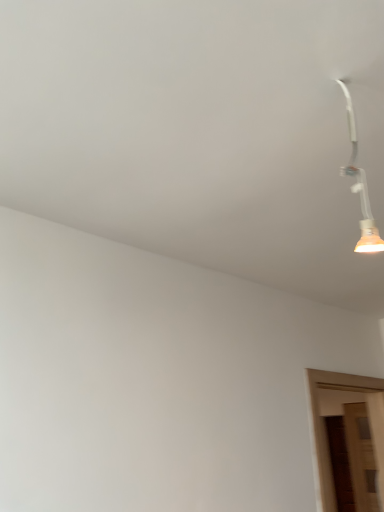
Question: Should I look upward or downward to see white plastic lamp at upper right?

Choices:
 (A) down
 (B) up

Answer: (B)

Question: Is wooden door at lower right located within white plastic lamp at upper right?

Choices:
 (A) yes
 (B) no

Answer: (B)

Question: Is white plastic lamp at upper right taller than wooden door at lower right?

Choices:
 (A) no
 (B) yes

Answer: (A)

Question: Does white plastic lamp at upper right have a smaller size compared to wooden door at lower right?

Choices:
 (A) no
 (B) yes

Answer: (B)

Question: Is white plastic lamp at upper right not near wooden door at lower right?

Choices:
 (A) yes
 (B) no

Answer: (A)

Question: From the image's perspective, is white plastic lamp at upper right below wooden door at lower right?

Choices:
 (A) yes
 (B) no

Answer: (B)

Question: Is white plastic lamp at upper right behind wooden door at lower right?

Choices:
 (A) yes
 (B) no

Answer: (B)

Question: Is wooden door at lower right outside white plastic lamp at upper right?

Choices:
 (A) yes
 (B) no

Answer: (A)

Question: Is wooden door at lower right oriented away from white plastic lamp at upper right?

Choices:
 (A) yes
 (B) no

Answer: (B)

Question: Is wooden door at lower right aimed at white plastic lamp at upper right?

Choices:
 (A) no
 (B) yes

Answer: (A)

Question: Would you consider wooden door at lower right to be distant from white plastic lamp at upper right?

Choices:
 (A) no
 (B) yes

Answer: (B)

Question: From a real-world perspective, is wooden door at lower right positioned under white plastic lamp at upper right based on gravity?

Choices:
 (A) no
 (B) yes

Answer: (B)

Question: Is wooden door at lower right further to the viewer compared to white plastic lamp at upper right?

Choices:
 (A) no
 (B) yes

Answer: (B)

Question: From a real-world perspective, is wooden door at lower right positioned above or below white plastic lamp at upper right?

Choices:
 (A) above
 (B) below

Answer: (B)